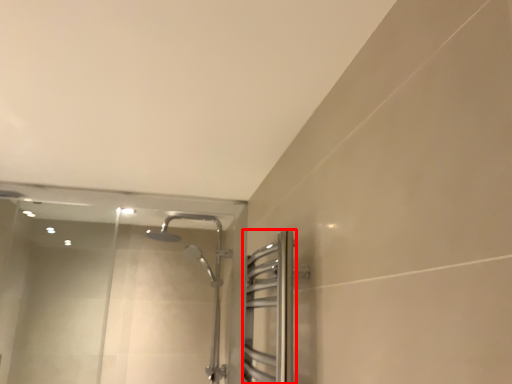
Question: From the image, what is the correct spatial relationship of screen door (annotated by the red box) in relation to glass door?

Choices:
 (A) right
 (B) left

Answer: (A)